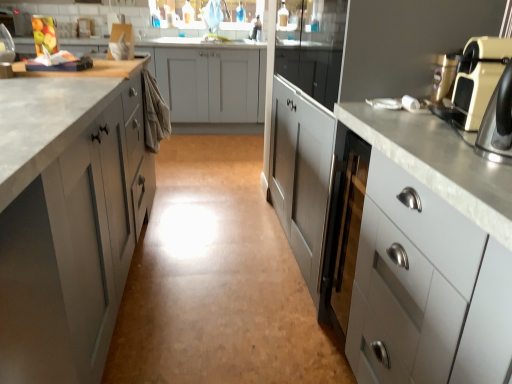
Question: Considering the relative positions of matte silver faucet at upper center and matte gray cabinet at left, the third cabinetry from the right, in the image provided, is matte silver faucet at upper center to the right of matte gray cabinet at left, the third cabinetry from the right, from the viewer's perspective?

Choices:
 (A) no
 (B) yes

Answer: (B)

Question: From the image's perspective, is matte silver faucet at upper center on top of matte gray cabinet at left, the third cabinetry from the right?

Choices:
 (A) no
 (B) yes

Answer: (B)

Question: Is matte silver faucet at upper center further to the viewer compared to matte gray cabinet at left, which is counted as the first cabinetry, starting from the left?

Choices:
 (A) no
 (B) yes

Answer: (B)

Question: Can you confirm if matte silver faucet at upper center is positioned to the left of matte gray cabinet at left, which is counted as the first cabinetry, starting from the left?

Choices:
 (A) no
 (B) yes

Answer: (A)

Question: Is matte silver faucet at upper center located outside matte gray cabinet at left, the third cabinetry from the right?

Choices:
 (A) yes
 (B) no

Answer: (A)

Question: Is matte gray cabinet at left, the third cabinetry from the right, surrounded by matte silver faucet at upper center?

Choices:
 (A) no
 (B) yes

Answer: (A)

Question: Is satin white cabinet at right, marked as the second cabinetry in a left-to-right arrangement, further to camera compared to beige plastic toaster at right?

Choices:
 (A) yes
 (B) no

Answer: (A)

Question: From the image's perspective, is satin white cabinet at right, the 2th cabinetry from the right, on top of beige plastic toaster at right?

Choices:
 (A) yes
 (B) no

Answer: (A)

Question: From a real-world perspective, is satin white cabinet at right, the 2th cabinetry from the right, under beige plastic toaster at right?

Choices:
 (A) yes
 (B) no

Answer: (A)

Question: Is satin white cabinet at right, the 2th cabinetry from the right, positioned beyond the bounds of beige plastic toaster at right?

Choices:
 (A) no
 (B) yes

Answer: (B)

Question: From a real-world perspective, is satin white cabinet at right, marked as the second cabinetry in a left-to-right arrangement, over beige plastic toaster at right?

Choices:
 (A) no
 (B) yes

Answer: (A)

Question: Does satin white cabinet at right, the 2th cabinetry from the right, appear on the right side of beige plastic toaster at right?

Choices:
 (A) yes
 (B) no

Answer: (B)

Question: Does beige plastic toaster at right have a larger size compared to matte silver faucet at upper center?

Choices:
 (A) yes
 (B) no

Answer: (B)